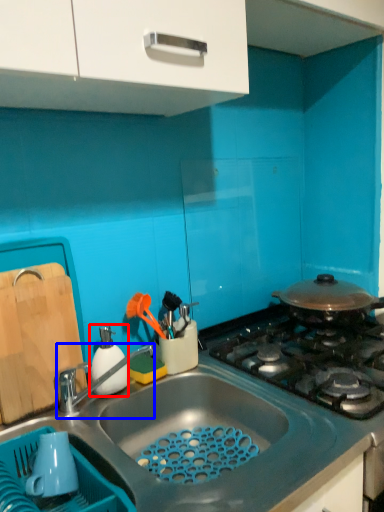
Question: Which of the following is the closest to the observer, appliance (highlighted by a red box) or tap (highlighted by a blue box)?

Choices:
 (A) appliance
 (B) tap

Answer: (B)